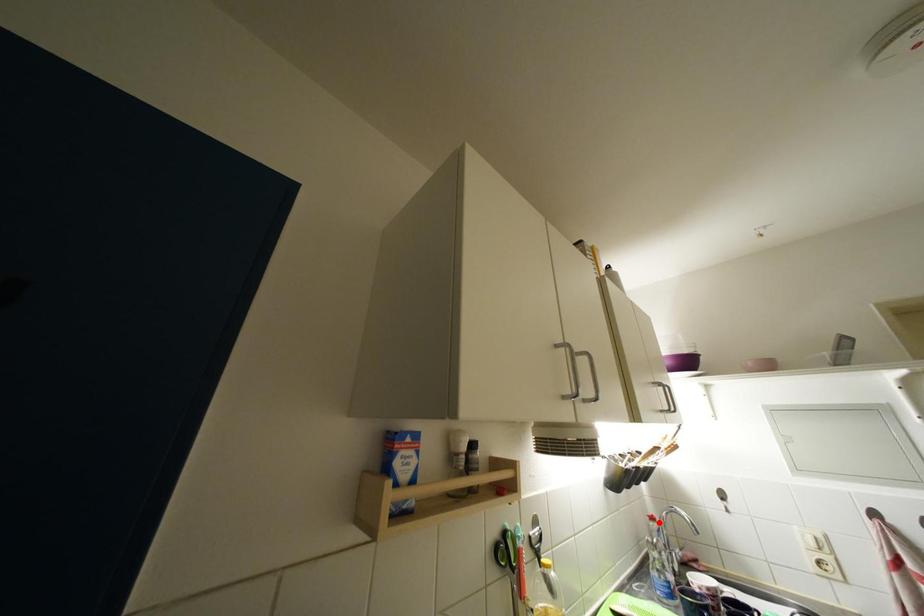
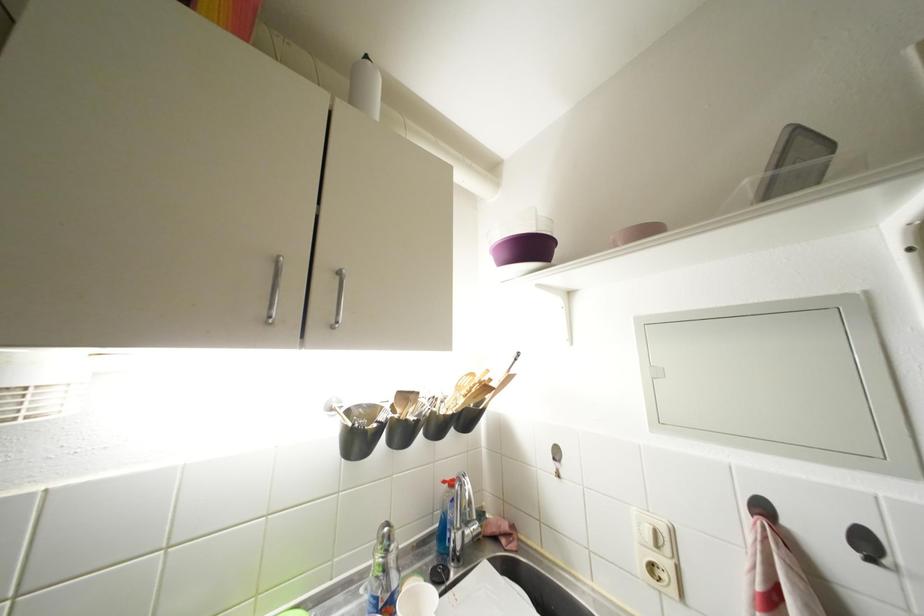
Where in the second image is the point corresponding to the highlighted location from the first image?

(457, 488)